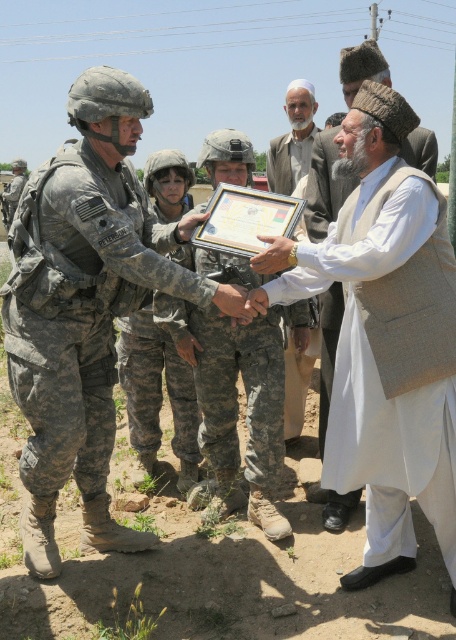
Can you confirm if camouflage uniform at left is wider than beige woolen cap at center?

Yes.

The height and width of the screenshot is (640, 456). Describe the element at coordinates (86, 307) in the screenshot. I see `camouflage uniform at left` at that location.

The image size is (456, 640). I want to click on camouflage uniform at left, so click(86, 307).

Which of these two, camouflage uniform at left or white cotton turban at upper center, stands taller?

camouflage uniform at left is taller.

Identify the location of camouflage uniform at left. click(86, 307).

Which is behind, point (423, 134) or point (284, 410)?

The point (284, 410) is more distant.

Which is in front, point (326, 310) or point (307, 141)?

Point (326, 310) is in front.

Locate an element on the screen. beige woolen cap at center is located at coordinates (325, 186).

Locate an element on the screen. Image resolution: width=456 pixels, height=640 pixels. beige woolen cap at center is located at coordinates (325, 186).